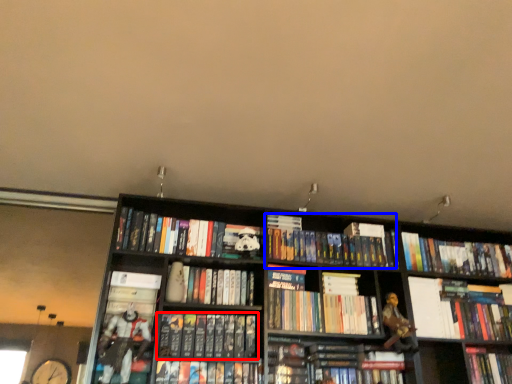
Question: Among these objects, which one is nearest to the camera, book (highlighted by a red box) or book (highlighted by a blue box)?

Choices:
 (A) book
 (B) book

Answer: (A)